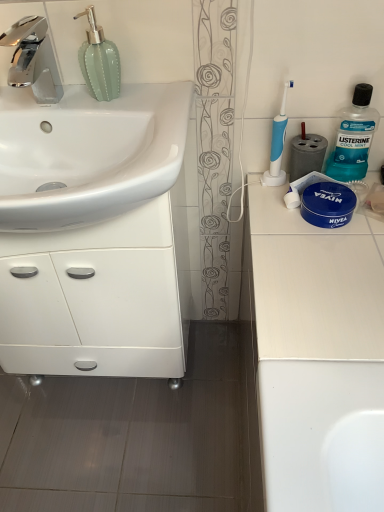
The height and width of the screenshot is (512, 384). In order to click on empty space that is to the right of green glass soap dispenser at upper left in this screenshot , I will do `click(143, 101)`.